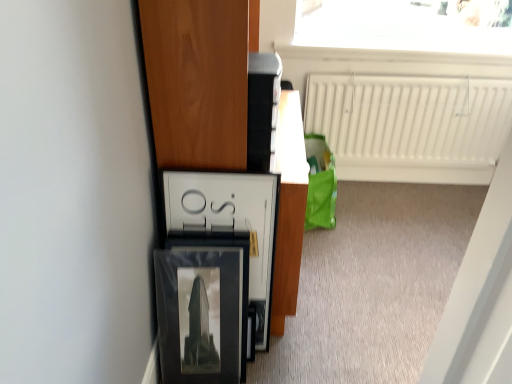
Find the location of a particular element. This screenshot has width=512, height=384. vacant space to the right of matte black picture frame at lower left is located at coordinates (286, 357).